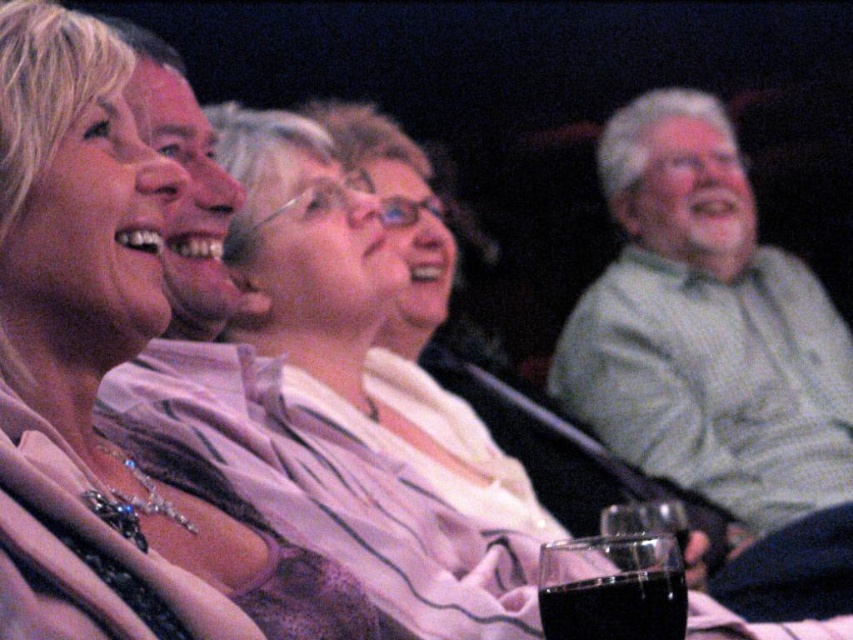
Question: Which is nearer to the matte black face at upper left?

Choices:
 (A) black glass at lower center
 (B) matte silver necklace at upper left
 (C) green textured shirt at right

Answer: (B)

Question: Can you confirm if green textured shirt at right is smaller than black glass at lower center?

Choices:
 (A) no
 (B) yes

Answer: (A)

Question: Which of the following is the farthest from the observer?

Choices:
 (A) matte silver necklace at upper left
 (B) green textured shirt at right

Answer: (B)

Question: Does green textured shirt at right have a larger size compared to matte black face at upper left?

Choices:
 (A) yes
 (B) no

Answer: (A)

Question: Which of the following is the farthest from the observer?

Choices:
 (A) (16, 260)
 (B) (555, 636)

Answer: (A)

Question: Does matte silver necklace at upper left appear on the left side of black glass at lower center?

Choices:
 (A) no
 (B) yes

Answer: (B)